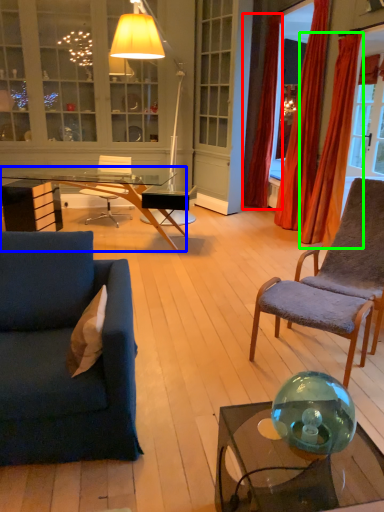
Question: Which object is positioned closest to curtain (highlighted by a red box)? Select from desk (highlighted by a blue box) and curtain (highlighted by a green box).

Choices:
 (A) desk
 (B) curtain

Answer: (B)